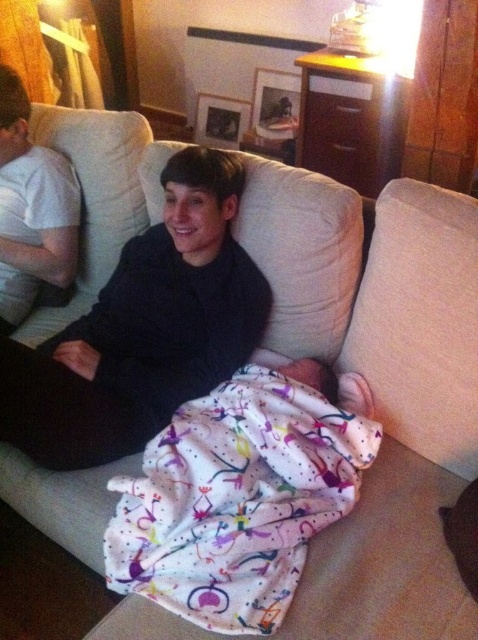
The height and width of the screenshot is (640, 478). Find the location of `black matte sweater at center`. black matte sweater at center is located at coordinates (143, 330).

Which of these two, black matte sweater at center or beige fabric pillow at right, stands taller?

With more height is black matte sweater at center.

Measure the distance between black matte sweater at center and camera.

A distance of 1.23 meters exists between black matte sweater at center and camera.

You are a GUI agent. You are given a task and a screenshot of the screen. Output one action in this format:
    pyautogui.click(x=<x>, y=<y>)
    Task: Click on the black matte sweater at center
    
    Given the screenshot: What is the action you would take?
    pyautogui.click(x=143, y=330)

Can you confirm if beige fabric pillow at right is bigger than matte black sweater at left?

Correct, beige fabric pillow at right is larger in size than matte black sweater at left.

Who is positioned more to the left, beige fabric pillow at right or matte black sweater at left?

matte black sweater at left

Which is behind, point (403, 301) or point (35, 157)?

Positioned behind is point (35, 157).

Where is `beige fabric pillow at right`? This screenshot has height=640, width=478. beige fabric pillow at right is located at coordinates (421, 321).

Is point (271, 499) more distant than point (23, 296)?

No.

Between printed fabric blanket at lower center and matte black sweater at left, which one is positioned higher?

matte black sweater at left is above.

Find the location of a particular element. The height and width of the screenshot is (640, 478). printed fabric blanket at lower center is located at coordinates (239, 497).